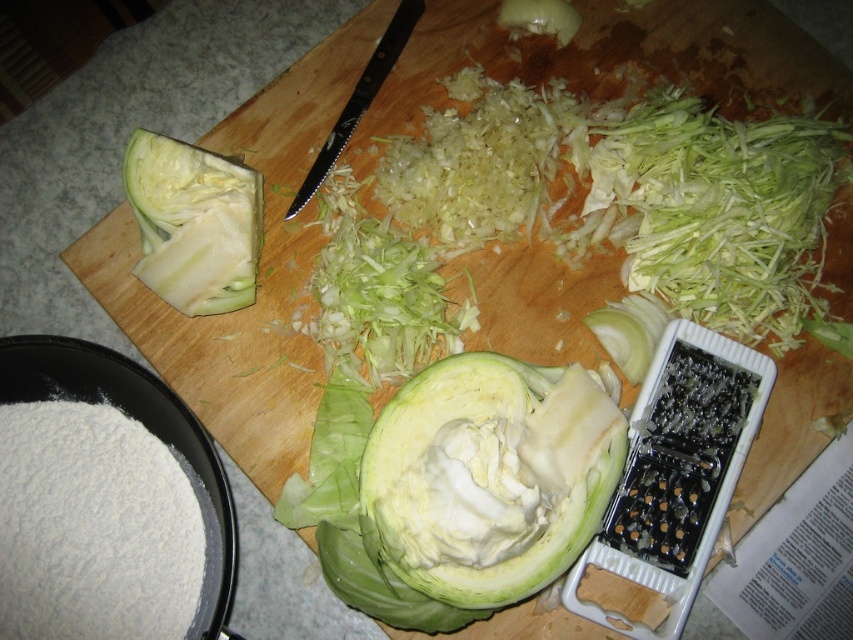
Question: Which object is farther from the camera taking this photo?

Choices:
 (A) green crisp cabbage at center
 (B) black plastic knife at upper center
 (C) white crisp cabbage at upper left
 (D) green leafy vegetable at upper center

Answer: (D)

Question: Which point is closer to the camera?

Choices:
 (A) (78, 529)
 (B) (148, 188)
 (C) (534, 3)

Answer: (A)

Question: Considering the real-world distances, which object is farthest from the white crisp cabbage at upper left?

Choices:
 (A) green leafy vegetable at upper center
 (B) black plastic knife at upper center
 (C) white powder at lower left
 (D) green crisp cabbage at center

Answer: (A)

Question: Where is green crisp cabbage at center located in relation to white powder at lower left in the image?

Choices:
 (A) right
 (B) left

Answer: (A)

Question: Does green crisp cabbage at center have a smaller size compared to white crisp cabbage at upper left?

Choices:
 (A) no
 (B) yes

Answer: (A)

Question: Is the position of green crisp cabbage at center more distant than that of black plastic knife at upper center?

Choices:
 (A) no
 (B) yes

Answer: (A)